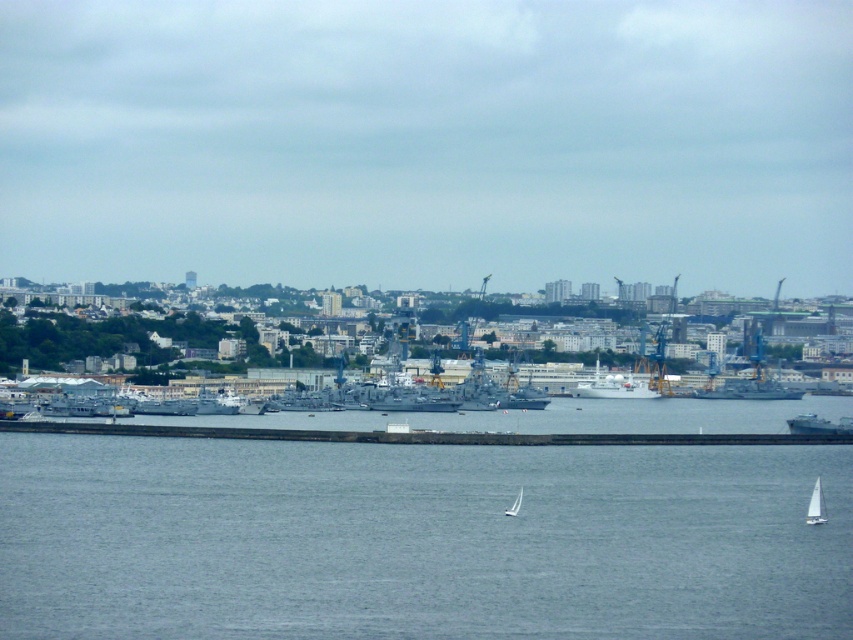
Question: Does metallic gray ship at right appear on the left side of white matte sailboat at lower right?

Choices:
 (A) yes
 (B) no

Answer: (B)

Question: Can you confirm if metallic gray ship at right is positioned above white matte sailboat at center?

Choices:
 (A) no
 (B) yes

Answer: (B)

Question: Which of the following is the closest to the observer?

Choices:
 (A) (309, 584)
 (B) (596, 371)

Answer: (B)

Question: Which of these objects is positioned closest to the metallic gray ship at right?

Choices:
 (A) white matte ship at center
 (B) white matte sailboat at lower right

Answer: (B)

Question: Which is nearer to the white matte ship at center?

Choices:
 (A) blue water at lower center
 (B) white matte sailboat at center

Answer: (B)

Question: Does white matte ship at center have a greater width compared to white matte sailboat at lower right?

Choices:
 (A) yes
 (B) no

Answer: (A)